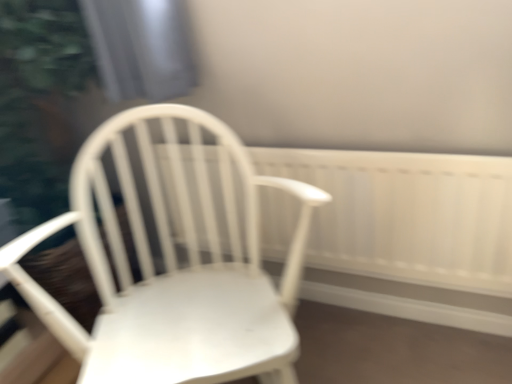
I want to click on blank space above white wooden radiator at center (from a real-world perspective), so click(x=316, y=134).